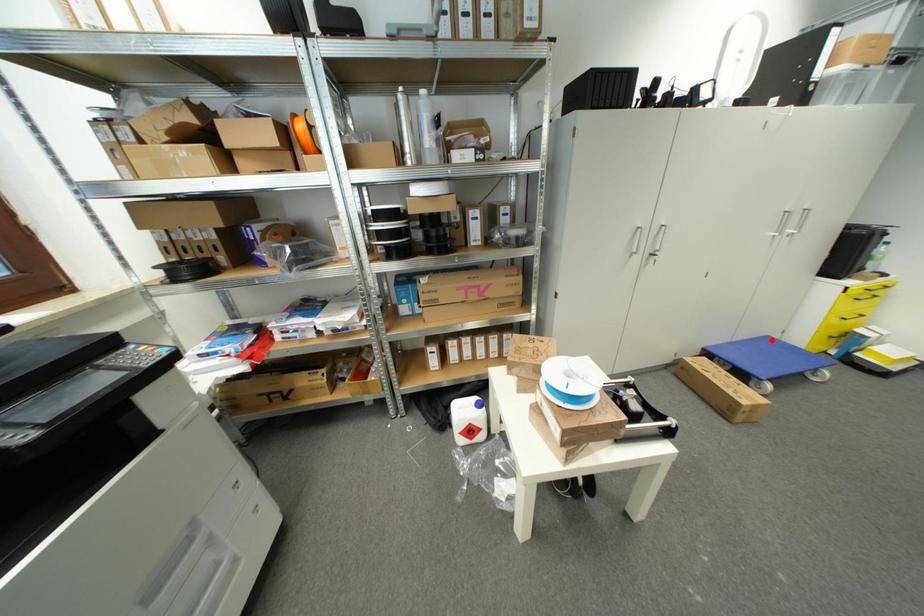
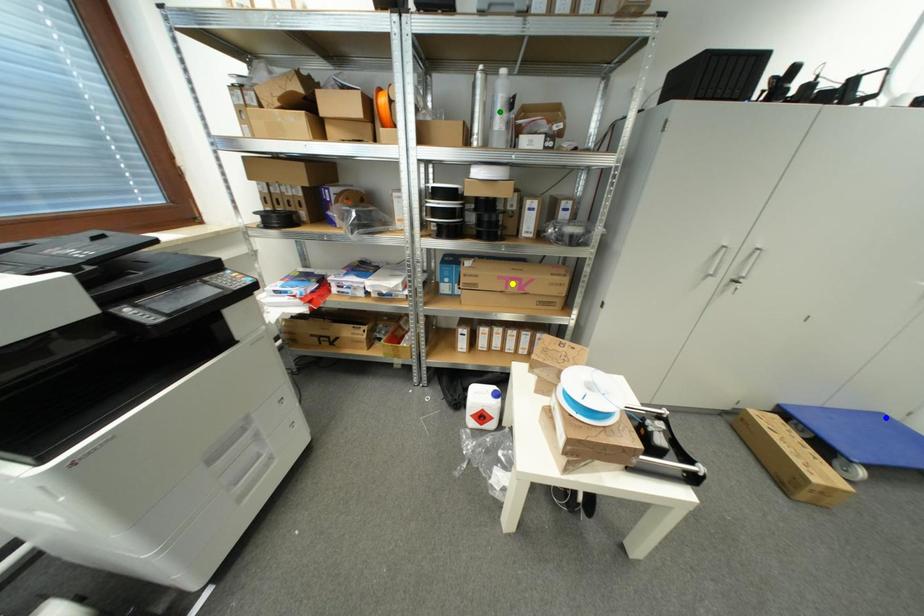
Question: I am providing you with two images of the same scene from different viewpoints. A red point is marked on the first image. You are given multiple points on the second image. Which mark in image 2 goes with the point in image 1?

Choices:
 (A) blue point
 (B) green point
 (C) yellow point

Answer: (A)